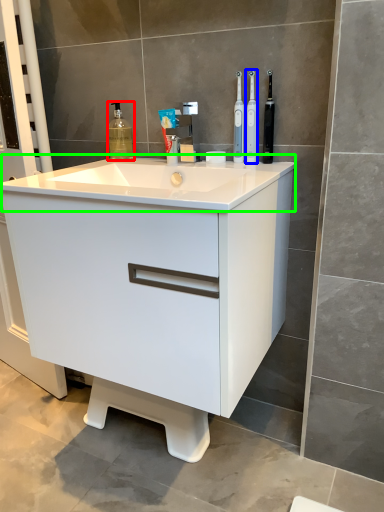
Question: Considering the real-world distances, which object is farthest from cleaning product (highlighted by a red box)? toothbrush (highlighted by a blue box) or counter top (highlighted by a green box)?

Choices:
 (A) toothbrush
 (B) counter top

Answer: (A)